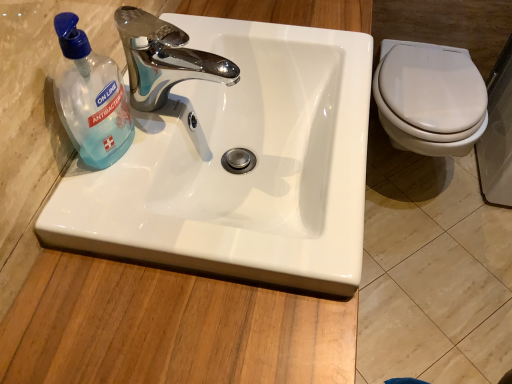
The image size is (512, 384). Describe the element at coordinates (240, 174) in the screenshot. I see `white glossy sink at center` at that location.

Where is `white glossy sink at center`? white glossy sink at center is located at coordinates (240, 174).

Find the location of a particular element. chrome/metallic faucet at upper center is located at coordinates (164, 59).

Measure the distance between transparent plastic bottle at left and chrome/metallic faucet at upper center.

They are 4.26 inches apart.

In the scene shown: Which of these two, transparent plastic bottle at left or chrome/metallic faucet at upper center, stands taller?

Standing taller between the two is transparent plastic bottle at left.

Could you tell me if transparent plastic bottle at left is turned towards chrome/metallic faucet at upper center?

No, transparent plastic bottle at left is not oriented towards chrome/metallic faucet at upper center.

Is transparent plastic bottle at left to the right of chrome/metallic faucet at upper center from the viewer's perspective?

In fact, transparent plastic bottle at left is to the left of chrome/metallic faucet at upper center.

In the scene shown: Between white glossy sink at center and transparent plastic bottle at left, which one appears on the right side from the viewer's perspective?

white glossy sink at center.

From a real-world perspective, is white glossy sink at center below transparent plastic bottle at left?

Yes.

Is there a large distance between white glossy sink at center and transparent plastic bottle at left?

white glossy sink at center is near transparent plastic bottle at left, not far away.

From a real-world perspective, who is located lower, white glossy sink at center or chrome/metallic faucet at upper center?

From a 3D spatial view, white glossy sink at center is below.

Between white glossy sink at center and chrome/metallic faucet at upper center, which one has larger width?

white glossy sink at center.

Considering the points (286, 42) and (148, 75), which point is in front, point (286, 42) or point (148, 75)?

The point (148, 75) is closer to the camera.

This screenshot has height=384, width=512. In order to click on sink below the chrome/metallic faucet at upper center (from the image's perspective) in this screenshot , I will do `click(240, 174)`.

Is transparent plastic bottle at left looking in the opposite direction of white glossy sink at center?

That's not correct — transparent plastic bottle at left is not looking away from white glossy sink at center.

Considering the positions of point (72, 65) and point (346, 45), is point (72, 65) closer or farther from the camera than point (346, 45)?

Clearly, point (72, 65) is closer to the camera than point (346, 45).

From a real-world perspective, relative to white glossy sink at center, is transparent plastic bottle at left vertically above or below?

Clearly, from a real-world perspective, transparent plastic bottle at left is above white glossy sink at center.

You are a GUI agent. You are given a task and a screenshot of the screen. Output one action in this format:
    pyautogui.click(x=<x>, y=<y>)
    Task: Click on the cleaning product below the chrome/metallic faucet at upper center (from the image's perspective)
    This screenshot has height=384, width=512.
    Given the screenshot: What is the action you would take?
    pyautogui.click(x=90, y=97)

Is chrome/metallic faucet at upper center next to transparent plastic bottle at left?

There is a gap between chrome/metallic faucet at upper center and transparent plastic bottle at left.

Consider the image. Considering the relative sizes of chrome/metallic faucet at upper center and transparent plastic bottle at left in the image provided, is chrome/metallic faucet at upper center smaller than transparent plastic bottle at left?

No.

Is chrome/metallic faucet at upper center spatially inside white glossy sink at center, or outside of it?

Result: The correct answer is: outside.

Considering the sizes of objects chrome/metallic faucet at upper center and white glossy sink at center in the image provided, who is smaller, chrome/metallic faucet at upper center or white glossy sink at center?

chrome/metallic faucet at upper center is smaller.

From the image's perspective, between chrome/metallic faucet at upper center and white glossy sink at center, who is located below?

white glossy sink at center.

Identify the location of sink below the chrome/metallic faucet at upper center (from the image's perspective). Image resolution: width=512 pixels, height=384 pixels. (240, 174).

Identify the location of tap on the right of the transparent plastic bottle at left. (164, 59).

What are the coordinates of `cleaning product above the white glossy sink at center (from the image's perspective)` in the screenshot? It's located at (90, 97).

Estimate the real-world distances between objects in this image. Which object is closer to chrome/metallic faucet at upper center, white glossy sink at center or transparent plastic bottle at left?

The object closer to chrome/metallic faucet at upper center is transparent plastic bottle at left.

Which object lies nearer to the anchor point white glossy sink at center, chrome/metallic faucet at upper center or transparent plastic bottle at left?

chrome/metallic faucet at upper center.

In the scene shown: Estimate the real-world distances between objects in this image. Which object is closer to transparent plastic bottle at left, chrome/metallic faucet at upper center or white glossy sink at center?

Based on the image, chrome/metallic faucet at upper center appears to be nearer to transparent plastic bottle at left.

Considering their positions, is transparent plastic bottle at left positioned further to white glossy sink at center than chrome/metallic faucet at upper center?

The object further to white glossy sink at center is transparent plastic bottle at left.

Looking at the image, which one is located closer to chrome/metallic faucet at upper center, transparent plastic bottle at left or white glossy sink at center?

Among the two, transparent plastic bottle at left is located nearer to chrome/metallic faucet at upper center.

Based on their spatial positions, is white glossy sink at center or chrome/metallic faucet at upper center further from transparent plastic bottle at left?

Based on the image, white glossy sink at center appears to be further to transparent plastic bottle at left.

What are the coordinates of `tap between transparent plastic bottle at left and white glossy sink at center from left to right` in the screenshot? It's located at (164, 59).